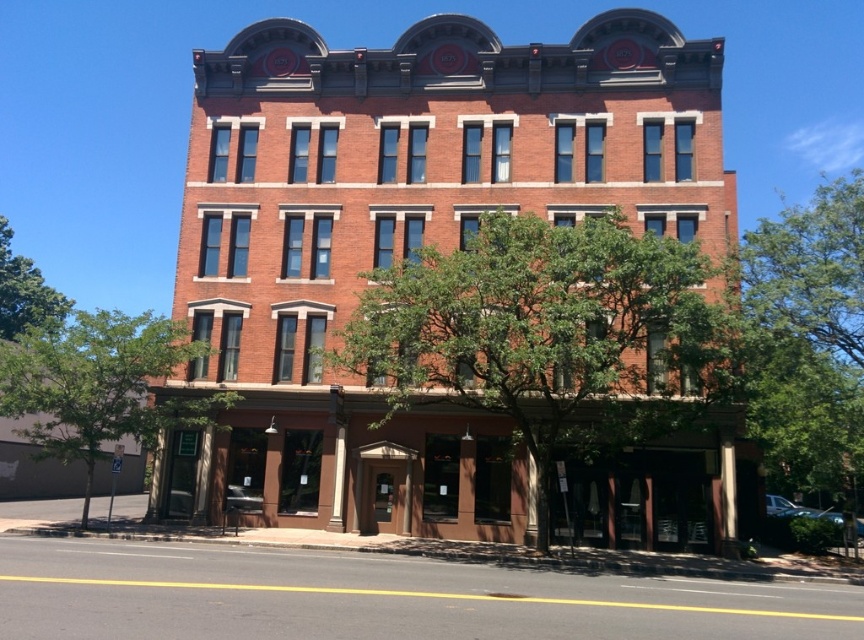
Question: Estimate the real-world distances between objects in this image. Which object is farther from the green leafy tree at lower left?

Choices:
 (A) green leafy tree at center
 (B) green leafy tree at upper right

Answer: (B)

Question: Does green leafy tree at lower left have a larger size compared to green leafy tree at upper right?

Choices:
 (A) no
 (B) yes

Answer: (A)

Question: Is green leafy tree at lower left thinner than green leafy tree at upper right?

Choices:
 (A) no
 (B) yes

Answer: (B)

Question: Which object appears closest to the camera in this image?

Choices:
 (A) green leafy tree at center
 (B) green leafy tree at lower left
 (C) green leafy tree at left
 (D) green leafy tree at upper right

Answer: (A)

Question: Which point appears closest to the camera in this image?

Choices:
 (A) (525, 369)
 (B) (121, 387)

Answer: (A)

Question: Can you confirm if green leafy tree at center is bigger than green leafy tree at lower left?

Choices:
 (A) no
 (B) yes

Answer: (A)